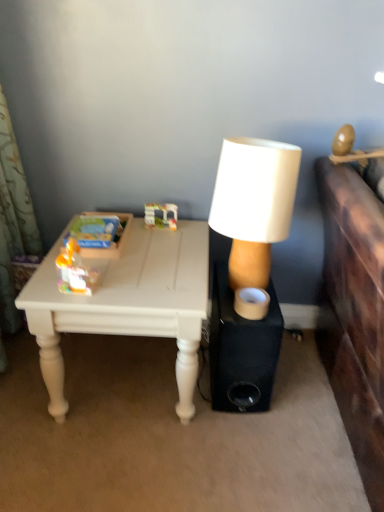
Find the location of a particular element. free space to the left of black matte speaker at center is located at coordinates (165, 388).